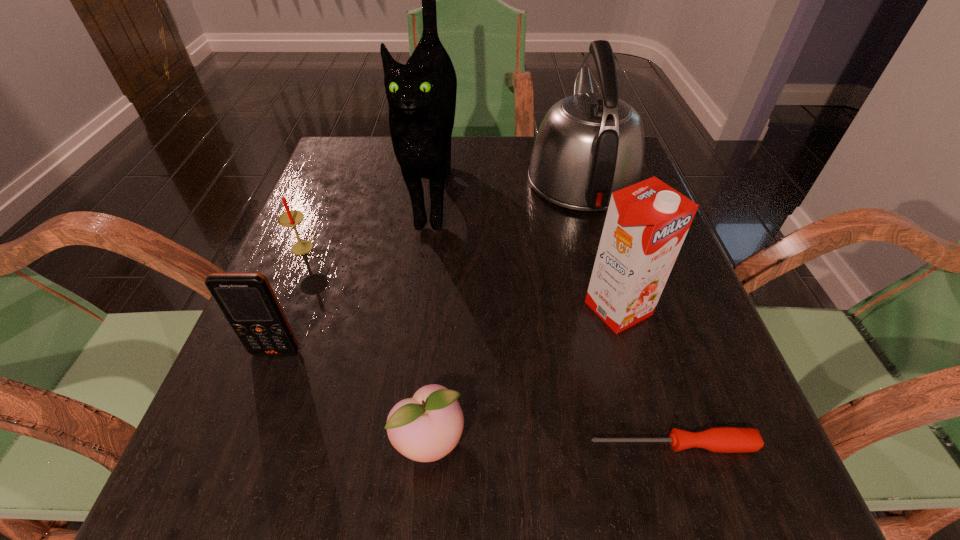
Locate an element on the screen. vacant space located on the front of the fourth farthest object is located at coordinates (636, 371).

Locate an element on the screen. The image size is (960, 540). free space located on the screen of the cellular telephone is located at coordinates (228, 475).

The height and width of the screenshot is (540, 960). I want to click on vacant space situated on the right of the candle, so click(x=426, y=248).

Where is `vacant space located 0.390m on the right of the peach`? The width and height of the screenshot is (960, 540). vacant space located 0.390m on the right of the peach is located at coordinates (752, 441).

Identify the location of vacant space positioned 0.390m at the tip of the shortest object. Image resolution: width=960 pixels, height=540 pixels. (301, 444).

At what (x,y) coordinates should I click in order to perform the action: click on vacant space located at the tip of the shortest object. Please return your answer as a coordinate pair (x, y). Image resolution: width=960 pixels, height=540 pixels. Looking at the image, I should click on (361, 444).

Locate an element on the screen. Image resolution: width=960 pixels, height=540 pixels. free location located 0.250m at the tip of the shortest object is located at coordinates (405, 444).

The image size is (960, 540). What are the coordinates of `cat that is at the far edge` in the screenshot? It's located at (421, 95).

This screenshot has width=960, height=540. I want to click on kettle situated at the far edge, so tap(589, 145).

This screenshot has height=540, width=960. I want to click on peach that is at the near edge, so click(x=425, y=428).